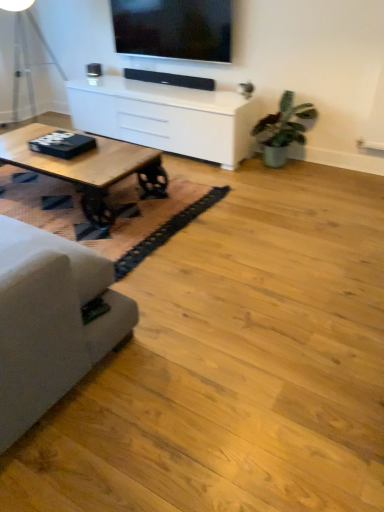
Image resolution: width=384 pixels, height=512 pixels. Describe the element at coordinates (112, 205) in the screenshot. I see `black woven mat at lower left` at that location.

What do you see at coordinates (88, 168) in the screenshot?
I see `wooden table at left` at bounding box center [88, 168].

Identify the location of wooden table at left. (88, 168).

You are a GUI agent. You are given a task and a screenshot of the screen. Output one action in this format:
    pyautogui.click(x=<x>, y=<y>)
    Task: Click on the black woven mat at lower left
    This screenshot has height=512, width=384.
    Given the screenshot: What is the action you would take?
    pyautogui.click(x=112, y=205)

How different are the orientations of suede gray couch at left and green matte plant at right in degrees?

suede gray couch at left and green matte plant at right are facing 179 degrees away from each other.

Between suede gray couch at left and green matte plant at right, which one has more height?

With more height is suede gray couch at left.

From a real-world perspective, is suede gray couch at left physically below green matte plant at right?

Actually, suede gray couch at left is physically above green matte plant at right in the real world.

Considering the sizes of objects black woven mat at lower left and white glossy cabinet at upper center in the image provided, who is thinner, black woven mat at lower left or white glossy cabinet at upper center?

white glossy cabinet at upper center.

Based on the photo, is black woven mat at lower left oriented away from white glossy cabinet at upper center?

black woven mat at lower left does not have its back to white glossy cabinet at upper center.

Which object is closer to the camera taking this photo, black woven mat at lower left or white glossy cabinet at upper center?

black woven mat at lower left is closer to the camera.

From a real-world perspective, which is physically above, black woven mat at lower left or white glossy cabinet at upper center?

white glossy cabinet at upper center is physically above.

Is wooden table at left next to green matte plant at right and touching it?

wooden table at left and green matte plant at right are clearly separated.

Is wooden table at left facing towards green matte plant at right?

No, wooden table at left does not turn towards green matte plant at right.

From the image's perspective, which object appears higher, wooden table at left or green matte plant at right?

green matte plant at right, from the image's perspective.

Is green matte plant at right a part of wooden table at left?

No, green matte plant at right is not surrounded by wooden table at left.

Is wooden table at left positioned far away from white glossy cabinet at upper center?

No, wooden table at left is in close proximity to white glossy cabinet at upper center.

Would you say wooden table at left is to the left or to the right of white glossy cabinet at upper center in the picture?

From the image, it's evident that wooden table at left is to the left of white glossy cabinet at upper center.

Is wooden table at left closer to camera compared to white glossy cabinet at upper center?

That is True.

Is wooden table at left wider than metallic silver table lamp at left?

Incorrect, the width of wooden table at left does not surpass that of metallic silver table lamp at left.

From a real-world perspective, which is physically above, wooden table at left or metallic silver table lamp at left?

metallic silver table lamp at left is physically above.

Consider the image. Is suede gray couch at left looking in the opposite direction of black woven mat at lower left?

No, suede gray couch at left is not facing away from black woven mat at lower left.

Is suede gray couch at left surrounding black woven mat at lower left?

Actually, black woven mat at lower left is outside suede gray couch at left.

Is suede gray couch at left next to black woven mat at lower left?

No.

Identify the location of mat above the suede gray couch at left (from the image's perspective). (112, 205).

Which object is positioned more to the right, white glossy cabinet at upper center or black woven mat at lower left?

From the viewer's perspective, white glossy cabinet at upper center appears more on the right side.

Between white glossy cabinet at upper center and black woven mat at lower left, which one is positioned behind?

white glossy cabinet at upper center is further from the camera.

Is white glossy cabinet at upper center placed right next to black woven mat at lower left?

white glossy cabinet at upper center and black woven mat at lower left are not in contact.

Considering the sizes of objects white glossy cabinet at upper center and black woven mat at lower left in the image provided, who is smaller, white glossy cabinet at upper center or black woven mat at lower left?

black woven mat at lower left is smaller.

I want to click on studio couch on the left of green matte plant at right, so click(51, 321).

At what (x,y) coordinates should I click in order to perform the action: click on table above the black woven mat at lower left (from the image's perspective). Please return your answer as a coordinate pair (x, y). Looking at the image, I should click on (166, 117).

Which object lies nearer to the anchor point suede gray couch at left, matte black tv at upper center or green matte plant at right?

Based on the image, green matte plant at right appears to be nearer to suede gray couch at left.

Estimate the real-world distances between objects in this image. Which object is further from black woven mat at lower left, metallic silver table lamp at left or white glossy cabinet at upper center?

metallic silver table lamp at left is positioned further to the anchor black woven mat at lower left.

Considering their positions, is suede gray couch at left positioned further to metallic silver table lamp at left than matte black tv at upper center?

Among the two, suede gray couch at left is located further to metallic silver table lamp at left.

Considering their positions, is green matte plant at right positioned closer to metallic silver table lamp at left than wooden table at left?

wooden table at left.

Considering their positions, is matte black tv at upper center positioned further to wooden table at left than green matte plant at right?

Based on the image, matte black tv at upper center appears to be further to wooden table at left.

From the image, which object appears to be farther from green matte plant at right, black woven mat at lower left or white glossy cabinet at upper center?

The object further to green matte plant at right is black woven mat at lower left.

Which object lies further to the anchor point black woven mat at lower left, wooden table at left or white glossy cabinet at upper center?

white glossy cabinet at upper center.

Based on their spatial positions, is matte black tv at upper center or suede gray couch at left closer to green matte plant at right?

The object closer to green matte plant at right is matte black tv at upper center.

Where is `table between metallic silver table lamp at left and black woven mat at lower left vertically`? The image size is (384, 512). table between metallic silver table lamp at left and black woven mat at lower left vertically is located at coordinates (166, 117).

At what (x,y) coordinates should I click in order to perform the action: click on mat between suede gray couch at left and wooden table at left in the front-back direction. Please return your answer as a coordinate pair (x, y). This screenshot has height=512, width=384. Looking at the image, I should click on (112, 205).

Where is `houseplant between suede gray couch at left and matte black tv at upper center in the front-back direction`? houseplant between suede gray couch at left and matte black tv at upper center in the front-back direction is located at coordinates (283, 129).

Where is `television between suede gray couch at left and metallic silver table lamp at left in the front-back direction`? television between suede gray couch at left and metallic silver table lamp at left in the front-back direction is located at coordinates (173, 29).